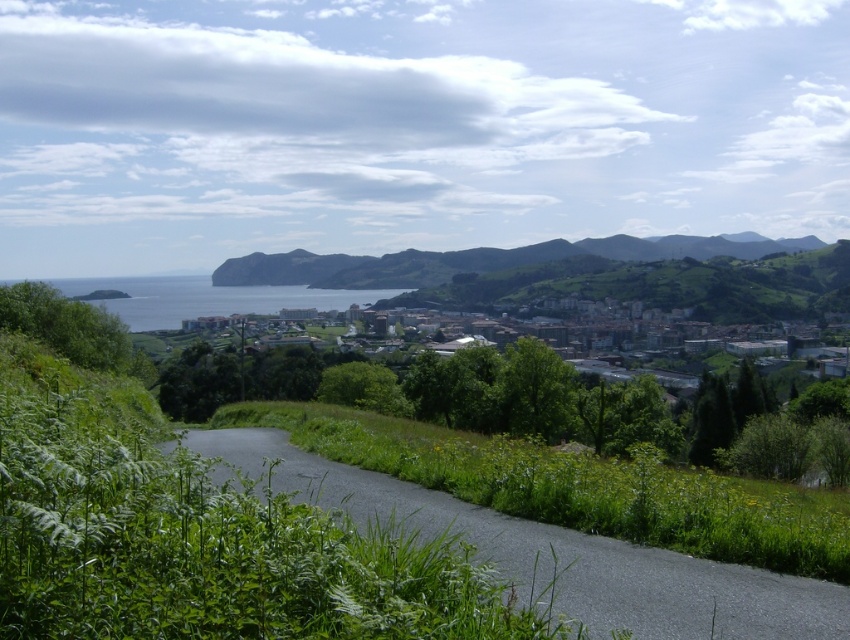
Does asphalt road at center lie behind brown stone buildings at center?

No.

Which is in front, point (836, 636) or point (666, 385)?

Point (836, 636)

Which is behind, point (694, 593) or point (604, 371)?

Point (604, 371)

The width and height of the screenshot is (850, 640). Find the location of `asphalt road at center`. asphalt road at center is located at coordinates (556, 554).